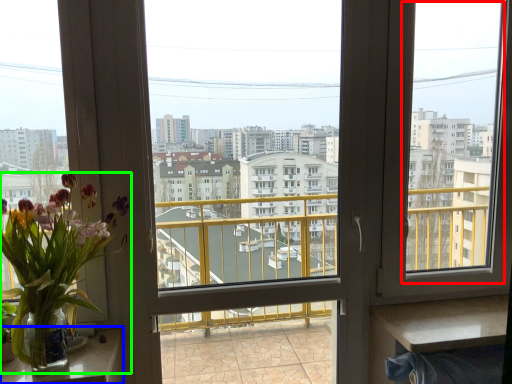
Question: Which is nearer to the window screen (highlighted by a red box)? table (highlighted by a blue box) or houseplant (highlighted by a green box).

Choices:
 (A) table
 (B) houseplant

Answer: (B)